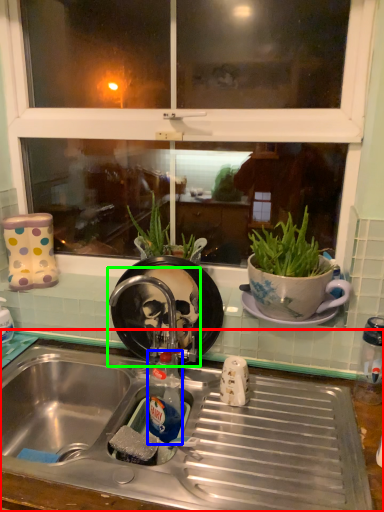
Question: Considering the real-world distances, which object is closest to desk (highlighted by a red box)? bottle (highlighted by a blue box) or faucet (highlighted by a green box).

Choices:
 (A) bottle
 (B) faucet

Answer: (A)